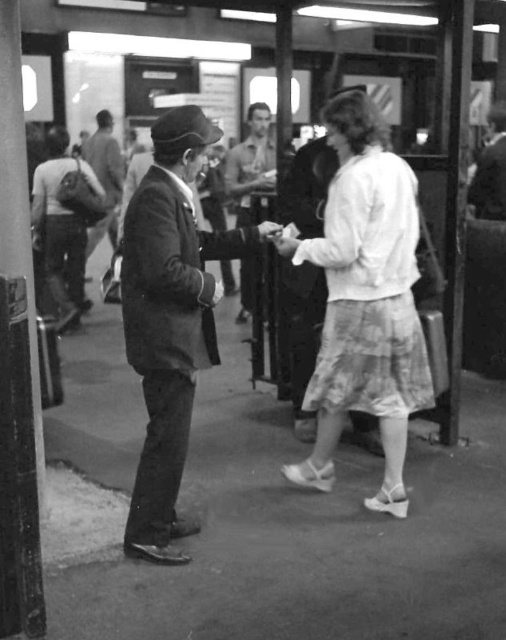
Question: Is smooth leather jacket at center positioned before smooth leather jacket at upper right?

Choices:
 (A) no
 (B) yes

Answer: (A)

Question: Among these points, which one is farthest from the camera?

Choices:
 (A) (482, 195)
 (B) (314, 385)
 (C) (161, 125)
 (D) (113, 170)

Answer: (D)

Question: Can you confirm if white cotton skirt at center is positioned to the left of smooth dark suit at left?

Choices:
 (A) no
 (B) yes

Answer: (A)

Question: Which object appears farthest from the camera in this image?

Choices:
 (A) smooth leather jacket at upper right
 (B) smooth dark suit at left
 (C) smooth fabric suit at center
 (D) smooth leather jacket at center

Answer: (C)

Question: Is white cotton skirt at center wider than smooth leather jacket at upper right?

Choices:
 (A) no
 (B) yes

Answer: (B)

Question: Estimate the real-world distances between objects in this image. Which object is farther from the smooth dark suit at left?

Choices:
 (A) smooth leather jacket at upper right
 (B) smooth leather jacket at center
 (C) white cotton skirt at center
 (D) smooth fabric suit at center

Answer: (D)